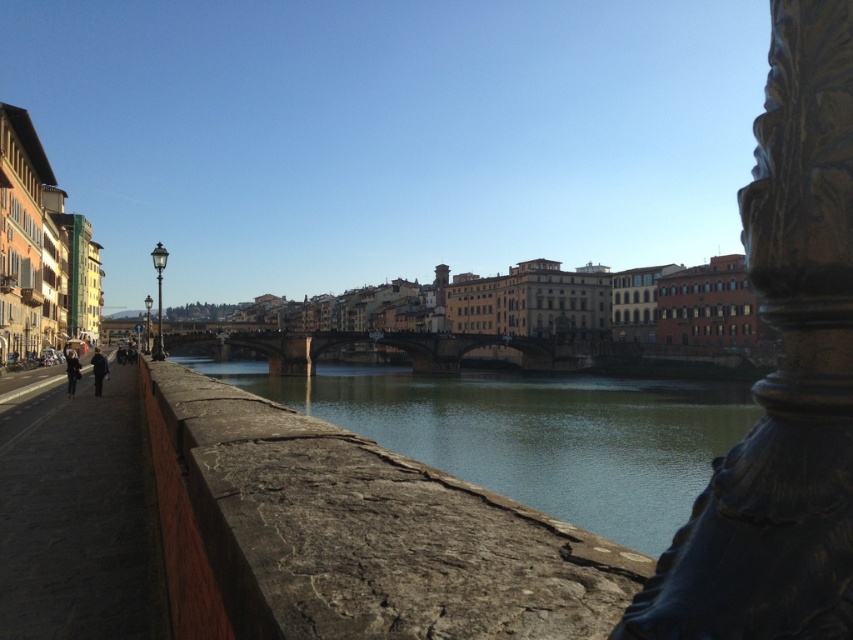
Between point (97, 371) and point (74, 362), which one is positioned behind?

The point (74, 362) is more distant.

The height and width of the screenshot is (640, 853). I want to click on dark blue fabric at left, so click(97, 369).

Is stone bridge at center smaller than dark blue fabric at left?

Actually, stone bridge at center might be larger than dark blue fabric at left.

What do you see at coordinates (387, 346) in the screenshot? I see `stone bridge at center` at bounding box center [387, 346].

I want to click on stone bridge at center, so click(387, 346).

The width and height of the screenshot is (853, 640). Identify the location of stone bridge at center. (387, 346).

Can you confirm if green stone river at center is positioned to the right of dark blue fabric at left?

Yes, green stone river at center is to the right of dark blue fabric at left.

Does point (373, 436) come in front of point (97, 356)?

No.

Which is in front, point (631, 403) or point (105, 365)?

Positioned in front is point (105, 365).

The width and height of the screenshot is (853, 640). What are the coordinates of `green stone river at center` in the screenshot? It's located at (534, 435).